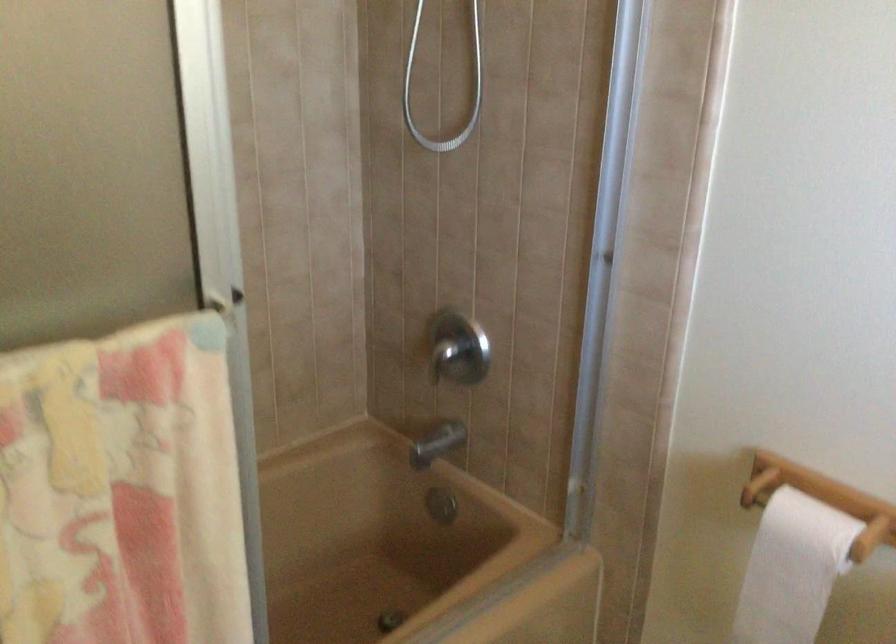
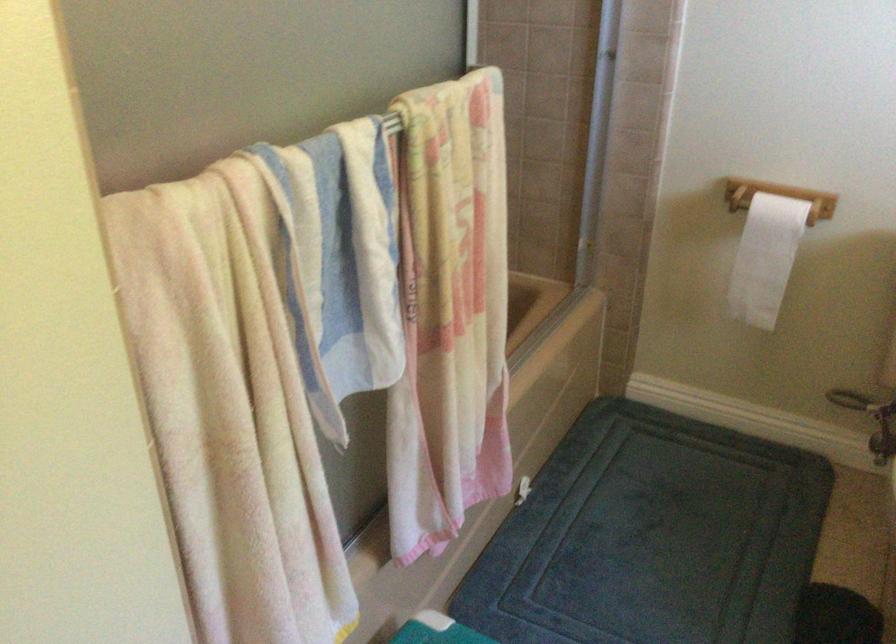
Question: I am providing you with two images of the same scene from different viewpoints. Which of the following objects are not visible in image2?

Choices:
 (A) white toilet paper
 (B) chrome faucet handle
 (C) metal shower handle
 (D) clothing rack wheel

Answer: (B)